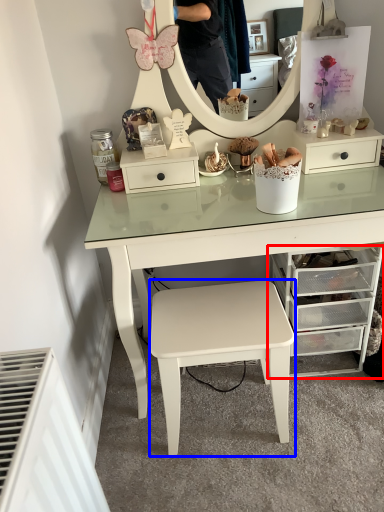
Question: Among these objects, which one is farthest to the camera, chest of drawers (highlighted by a red box) or stool (highlighted by a blue box)?

Choices:
 (A) chest of drawers
 (B) stool

Answer: (A)